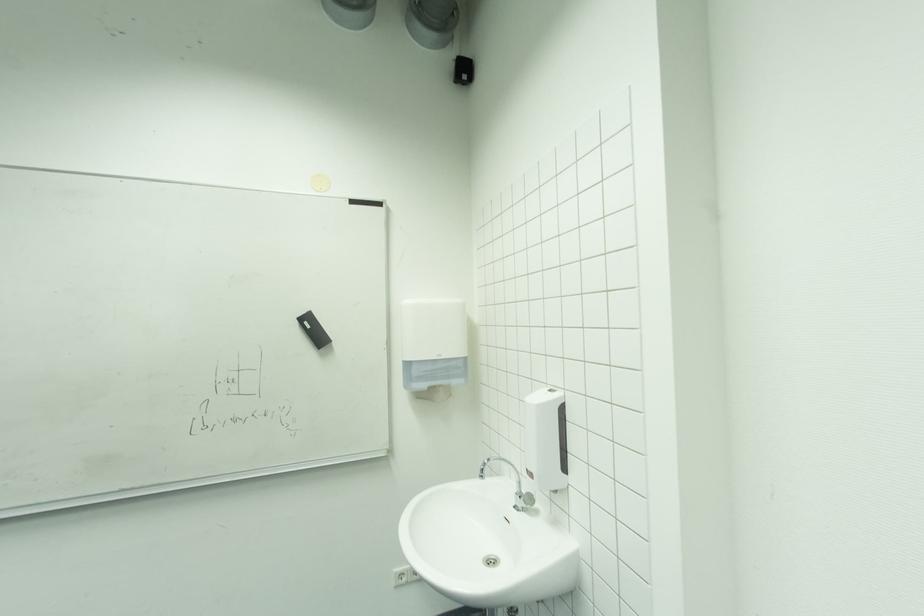
Where is `faucet handle`? faucet handle is located at coordinates (523, 498).